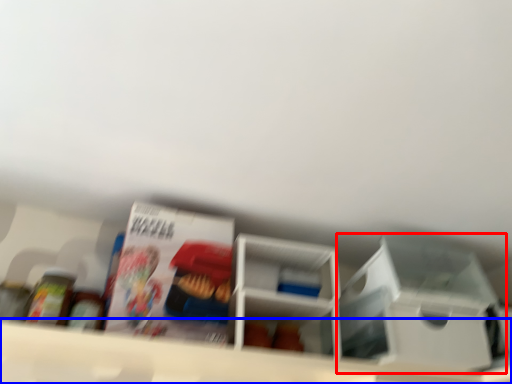
Question: Among these objects, which one is nearest to the camera, storage box (highlighted by a red box) or shelf (highlighted by a blue box)?

Choices:
 (A) storage box
 (B) shelf

Answer: (B)